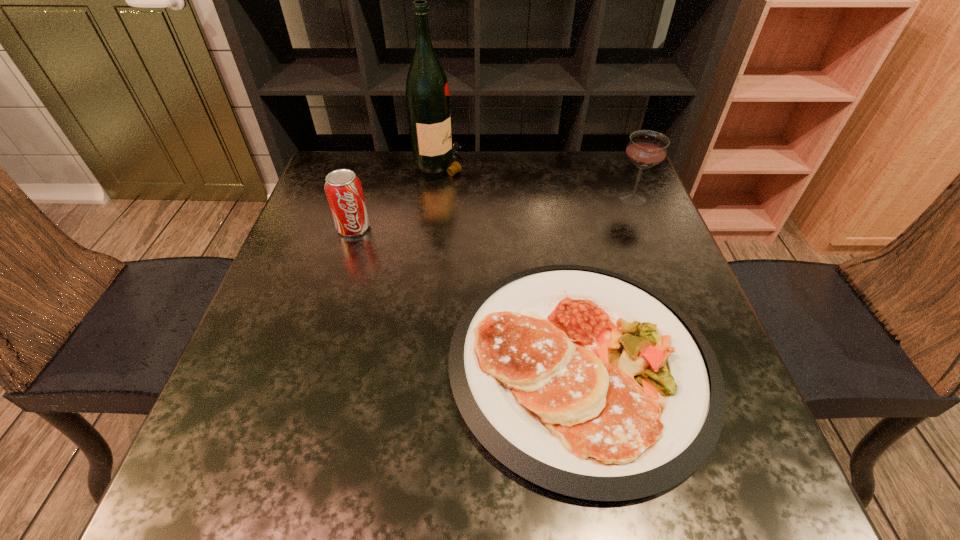
Find the location of `vacant region located 0.100m on the left of the dish`. vacant region located 0.100m on the left of the dish is located at coordinates (395, 364).

Where is `wine bottle present at the far edge`? This screenshot has height=540, width=960. wine bottle present at the far edge is located at coordinates (427, 92).

The height and width of the screenshot is (540, 960). What are the coordinates of `wineglass that is at the far edge` in the screenshot? It's located at (646, 149).

The width and height of the screenshot is (960, 540). I want to click on object that is at the near edge, so click(588, 383).

This screenshot has height=540, width=960. I want to click on object present at the left edge, so click(343, 189).

You are a GUI agent. You are given a task and a screenshot of the screen. Output one action in this format:
    pyautogui.click(x=<x>, y=<y>)
    Task: Click on the wineglass at the right edge
    The width and height of the screenshot is (960, 540).
    Given the screenshot: What is the action you would take?
    (646, 149)

Find the location of a particular element. The image size is (960, 540). dish situated at the right edge is located at coordinates (588, 383).

Where is `object that is at the far right corner`? This screenshot has width=960, height=540. object that is at the far right corner is located at coordinates tap(646, 149).

I want to click on object present at the near right corner, so click(x=588, y=383).

You are a GUI agent. You are given a task and a screenshot of the screen. Output one action in this format:
    pyautogui.click(x=<x>, y=<y>)
    Task: Click on the vacant space at the far edge
    Image resolution: width=960 pixels, height=540 pixels.
    Given the screenshot: What is the action you would take?
    pyautogui.click(x=498, y=194)